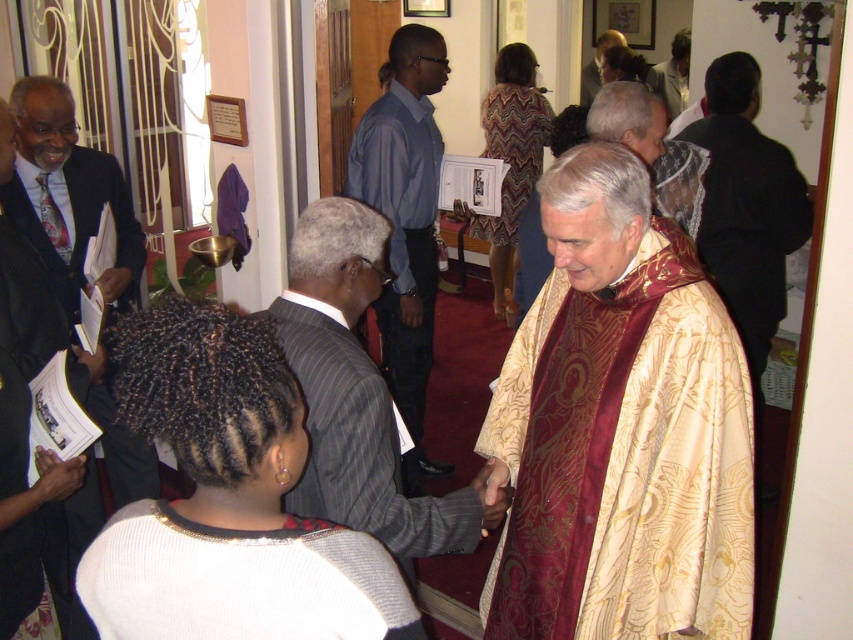
You are standing at the entrance of the church and see two points marked in the scene. The first point is at coordinates point (154, 632) and the second point is at point (67, 541). Which point is closer to you?

Point (154, 632) is in front of point (67, 541), so it is closer to you.

You are an event planner arranging seating for an upcoming ceremony. You need to place a chair for the person wearing the white knitted sweater at center and another chair for the person in the dark suit at left. Based on their positions in the image, which chair should be placed higher up on the stage?

The dark suit at left should be placed higher up on the stage because the white knitted sweater at center is positioned below it in the image.